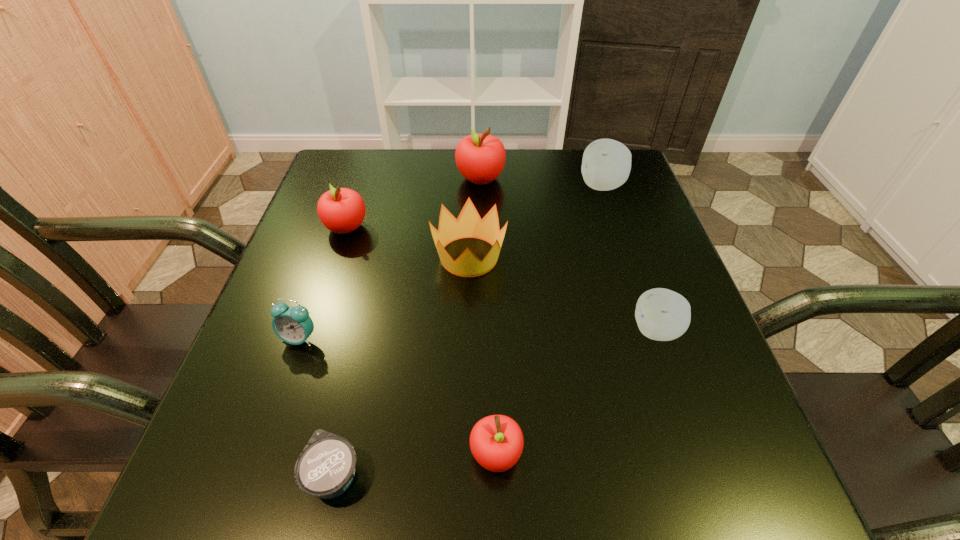
Image resolution: width=960 pixels, height=540 pixels. In the image, there is a desktop. Find the location of `vacant space at the right edge`. vacant space at the right edge is located at coordinates tap(631, 301).

Identify the location of vacant space at the far left corner of the desktop. This screenshot has height=540, width=960. (331, 162).

You are a GUI agent. You are given a task and a screenshot of the screen. Output one action in this format:
    pyautogui.click(x=<x>, y=<y>)
    Task: Click on the vacant space that's between the third object from left to right and the alarm clock
    This screenshot has width=960, height=540.
    Given the screenshot: What is the action you would take?
    pyautogui.click(x=317, y=406)

The image size is (960, 540). I want to click on vacant area that lies between the smallest red apple and the crown, so (483, 355).

Where is `vacant region between the second smallest red apple and the alarm clock`? vacant region between the second smallest red apple and the alarm clock is located at coordinates (323, 283).

Image resolution: width=960 pixels, height=540 pixels. Identify the location of unoccupied area between the bigger white apple and the nearest red apple. (549, 320).

The image size is (960, 540). Find the location of `unoccupied position between the alarm clock and the nearest red apple`. unoccupied position between the alarm clock and the nearest red apple is located at coordinates (397, 396).

Identify the location of free space between the third object from left to right and the third nearest apple. The width and height of the screenshot is (960, 540). (340, 350).

Where is `empty space that is in between the third nearest apple and the alarm clock`? This screenshot has width=960, height=540. empty space that is in between the third nearest apple and the alarm clock is located at coordinates (323, 283).

This screenshot has width=960, height=540. In order to click on free space between the third nearest apple and the sixth object from right to left in this screenshot , I will do `click(340, 350)`.